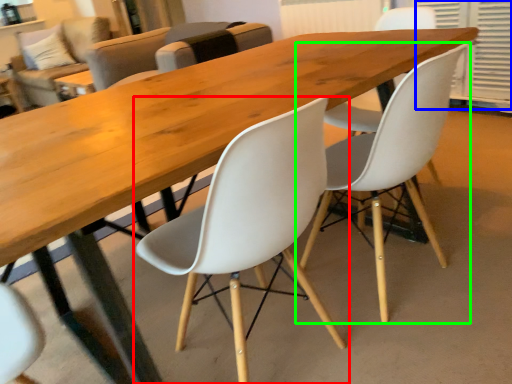
Question: Which is farther away from chair (highlighted by a red box)? shutter (highlighted by a blue box) or chair (highlighted by a green box)?

Choices:
 (A) shutter
 (B) chair

Answer: (A)